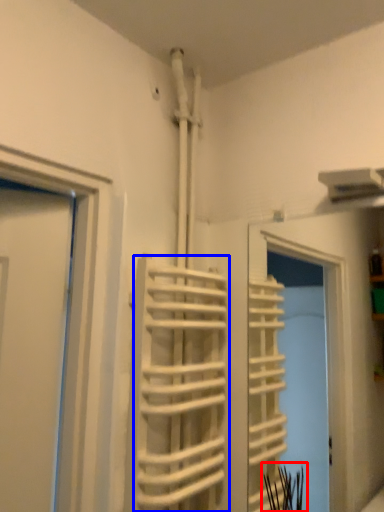
Question: Which object appears closest to the camera in this image, plant (highlighted by a red box) or stair (highlighted by a blue box)?

Choices:
 (A) plant
 (B) stair

Answer: (B)